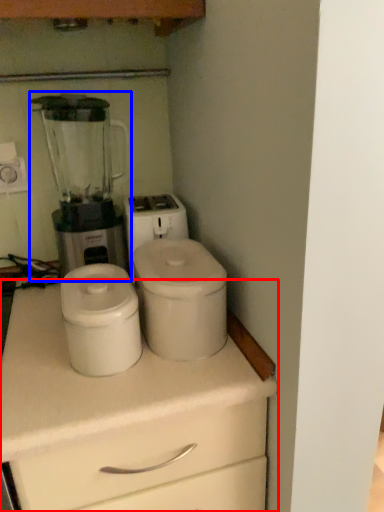
Question: Which object appears closest to the camera in this image, chest of drawers (highlighted by a red box) or blender (highlighted by a blue box)?

Choices:
 (A) chest of drawers
 (B) blender

Answer: (A)